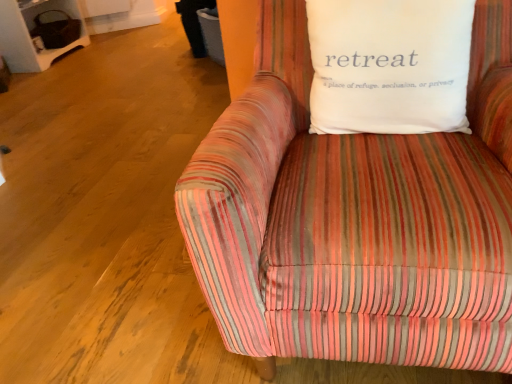
Identify the location of white cotton pillow at upper right. (389, 65).

Consider the image. Measure the distance between point (455, 14) and camera.

Point (455, 14) and camera are 35.47 inches apart.

The image size is (512, 384). Describe the element at coordinates (389, 65) in the screenshot. I see `white cotton pillow at upper right` at that location.

The height and width of the screenshot is (384, 512). Describe the element at coordinates (348, 212) in the screenshot. I see `striped fabric couch at center` at that location.

This screenshot has height=384, width=512. Find the location of `striped fabric couch at center`. striped fabric couch at center is located at coordinates (348, 212).

At what (x,y) coordinates should I click in order to perform the action: click on white cotton pillow at upper right. Please return your answer as a coordinate pair (x, y). Looking at the image, I should click on (389, 65).

Which is more to the left, striped fabric couch at center or white cotton pillow at upper right?

From the viewer's perspective, white cotton pillow at upper right appears more on the left side.

Which object is closer to the camera, striped fabric couch at center or white cotton pillow at upper right?

striped fabric couch at center is in front.

Considering the points (297, 183) and (393, 24), which point is in front, point (297, 183) or point (393, 24)?

Positioned in front is point (297, 183).

From the image's perspective, which one is positioned lower, striped fabric couch at center or white cotton pillow at upper right?

striped fabric couch at center appears lower in the image.

From a real-world perspective, which object stands above the other?

In real-world perspective, white cotton pillow at upper right is above.

Between striped fabric couch at center and white cotton pillow at upper right, which one has larger width?

striped fabric couch at center is wider.

Considering the relative sizes of striped fabric couch at center and white cotton pillow at upper right in the image provided, is striped fabric couch at center taller than white cotton pillow at upper right?

Correct, striped fabric couch at center is much taller as white cotton pillow at upper right.

Can you confirm if striped fabric couch at center is smaller than white cotton pillow at upper right?

Incorrect, striped fabric couch at center is not smaller in size than white cotton pillow at upper right.

Could white cotton pillow at upper right be considered to be inside striped fabric couch at center?

That's correct, white cotton pillow at upper right is inside striped fabric couch at center.

In the scene shown: Is striped fabric couch at center far away from white cotton pillow at upper right?

No.

Is striped fabric couch at center oriented away from white cotton pillow at upper right?

Absolutely, striped fabric couch at center is directed away from white cotton pillow at upper right.

How many degrees apart are the facing directions of striped fabric couch at center and white cotton pillow at upper right?

0.0118 degrees.

What are the coordinates of `pillow lying above the striped fabric couch at center (from the image's perspective)` in the screenshot? It's located at (389, 65).

Considering the relative positions of white cotton pillow at upper right and striped fabric couch at center in the image provided, is white cotton pillow at upper right to the left of striped fabric couch at center from the viewer's perspective?

Indeed, white cotton pillow at upper right is positioned on the left side of striped fabric couch at center.

Is white cotton pillow at upper right behind striped fabric couch at center?

Yes, it is behind striped fabric couch at center.

Between point (450, 91) and point (199, 182), which one is positioned behind?

Positioned behind is point (450, 91).

From the image's perspective, is white cotton pillow at upper right located above or below striped fabric couch at center?

From the image's perspective, white cotton pillow at upper right appears above striped fabric couch at center.

From a real-world perspective, which is physically above, white cotton pillow at upper right or striped fabric couch at center?

In real-world perspective, white cotton pillow at upper right is above.

Is white cotton pillow at upper right wider or thinner than striped fabric couch at center?

Clearly, white cotton pillow at upper right has less width compared to striped fabric couch at center.

Considering the sizes of white cotton pillow at upper right and striped fabric couch at center in the image, is white cotton pillow at upper right taller or shorter than striped fabric couch at center?

Considering their sizes, white cotton pillow at upper right has less height than striped fabric couch at center.

Considering the relative sizes of white cotton pillow at upper right and striped fabric couch at center in the image provided, is white cotton pillow at upper right bigger than striped fabric couch at center?

Incorrect, white cotton pillow at upper right is not larger than striped fabric couch at center.

Could striped fabric couch at center be considered to be inside white cotton pillow at upper right?

That's incorrect, striped fabric couch at center is not inside white cotton pillow at upper right.

Is the surface of white cotton pillow at upper right in direct contact with striped fabric couch at center?

No, white cotton pillow at upper right is not next to striped fabric couch at center.

Is white cotton pillow at upper right facing towards striped fabric couch at center?

Yes.

You are a GUI agent. You are given a task and a screenshot of the screen. Output one action in this format:
    pyautogui.click(x=<x>, y=<y>)
    Task: Click on the pillow that appears above the striped fabric couch at center (from a real-world perspective)
    
    Given the screenshot: What is the action you would take?
    pyautogui.click(x=389, y=65)

Find the location of a particular element. The image size is (512, 384). pillow on the left of the striped fabric couch at center is located at coordinates (389, 65).

Identify the location of pillow located above the striped fabric couch at center (from the image's perspective). (389, 65).